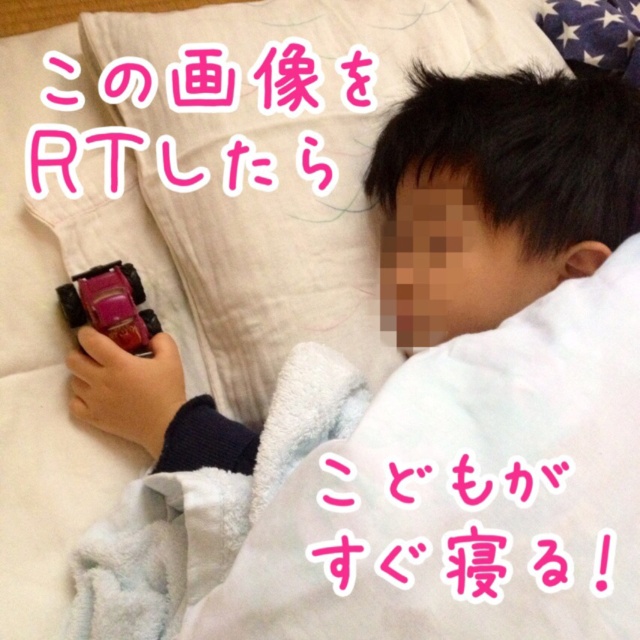
Based on the scene described, can you determine the spatial relationship between the smooth skin face at upper right and the shiny red car at lower left?

The smooth skin face at upper right is positioned over the shiny red car at lower left.

You are a photographer adjusting your camera settings. You notice two points in the image at coordinates point (x=477, y=157) and point (x=116, y=321). Which point should you focus on to ensure the foreground is sharp?

You should focus on point (x=477, y=157) because it is closer to the camera than point (x=116, y=321), ensuring the foreground element is in sharp focus.